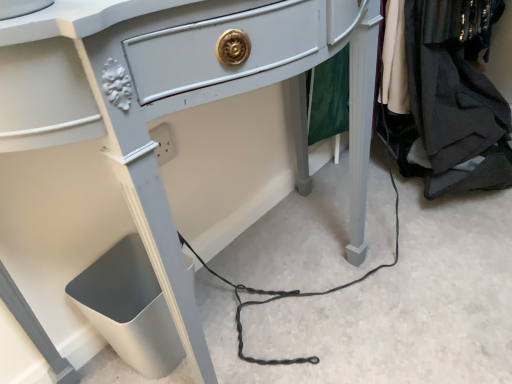
What is the approximate width of dark gray fabric at right?

44.75 centimeters.

This screenshot has width=512, height=384. What do you see at coordinates (441, 106) in the screenshot?
I see `dark gray fabric at right` at bounding box center [441, 106].

This screenshot has width=512, height=384. In order to click on dark gray fabric at right in this screenshot , I will do `click(441, 106)`.

At what (x,y) coordinates should I click in order to perform the action: click on dark gray fabric at right. Please return your answer as a coordinate pair (x, y). The width and height of the screenshot is (512, 384). Looking at the image, I should click on tap(441, 106).